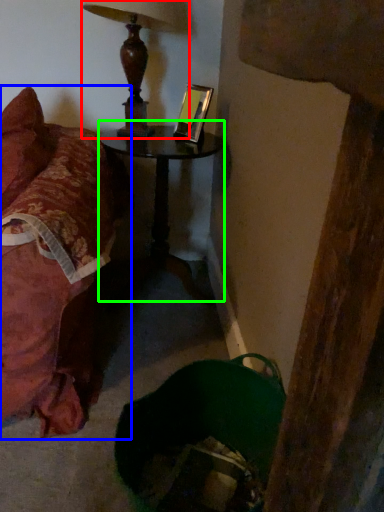
Question: Which is farther away from lamp (highlighted by a red box)? furniture (highlighted by a blue box) or table (highlighted by a green box)?

Choices:
 (A) furniture
 (B) table

Answer: (A)